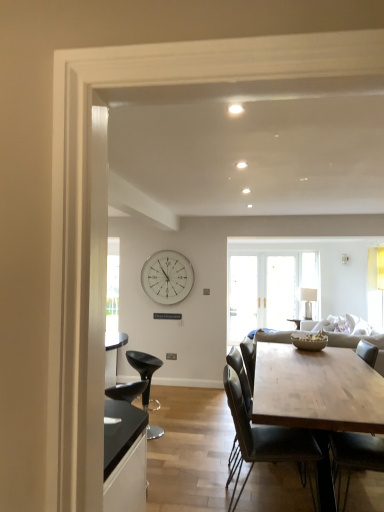
What do you see at coordinates (317, 397) in the screenshot? This screenshot has height=512, width=384. I see `natural wood table at center` at bounding box center [317, 397].

How much space does black plastic stool at lower left, which is the 1th chair in left-to-right order, occupy vertically?

It is 31.30 inches.

What are the coordinates of `black plastic stool at lower left, the first chair in the back-to-front sequence` in the screenshot? It's located at (144, 370).

At what (x,y) coordinates should I click in order to perform the action: click on light gray fabric couch at center. Please return your answer as a coordinate pair (x, y). This screenshot has width=384, height=512. Looking at the image, I should click on (356, 344).

What do you see at coordinates (265, 440) in the screenshot? I see `dark gray leather chair at center, the 2th chair when ordered from front to back` at bounding box center [265, 440].

In order to face wooden chair at center, which is the 3th chair from left to right, should I rotate leftwards or rightwards?

To face it directly, rotate right by 21.685 degrees.

This screenshot has height=512, width=384. I want to click on natural wood table at center, so click(317, 397).

From the image's perspective, between wooden chair at center, the third chair in the back-to-front sequence, and dark gray leather chair at center, the second chair viewed from the right, who is located below?

From the image's view, wooden chair at center, the third chair in the back-to-front sequence, is below.

This screenshot has width=384, height=512. I want to click on chair that is the 1st one when counting backward from the wooden chair at center, which is the first chair in front-to-back order, so click(x=265, y=440).

Which is less distant, [380,466] or [237,422]?

The point [237,422] is more forward.

How distant is wooden chair at center, which is the 3th chair from left to right, from dark gray leather chair at center, the 2th chair from the left?

They are 16.45 inches apart.

Looking at this image, which of these two, dark gray leather chair at center, which ranks as the 2th chair in back-to-front order, or natural wood table at center, is wider?

natural wood table at center is wider.

From the image's perspective, who appears lower, dark gray leather chair at center, the second chair viewed from the right, or natural wood table at center?

natural wood table at center is shown below in the image.

Are dark gray leather chair at center, which ranks as the 2th chair in back-to-front order, and natural wood table at center located far from each other?

No, dark gray leather chair at center, which ranks as the 2th chair in back-to-front order, is not far away from natural wood table at center.

Considering the relative sizes of dark gray leather chair at center, the 2th chair from the left, and natural wood table at center in the image provided, is dark gray leather chair at center, the 2th chair from the left, bigger than natural wood table at center?

No, dark gray leather chair at center, the 2th chair from the left, is not bigger than natural wood table at center.

Is black plastic stool at lower left, the first chair in the back-to-front sequence, at the left side of white glossy clock at upper center?

Yes.

From the image's perspective, is black plastic stool at lower left, marked as the 3th chair in a front-to-back arrangement, positioned above or below white glossy clock at upper center?

black plastic stool at lower left, marked as the 3th chair in a front-to-back arrangement, is below white glossy clock at upper center.

Does point (141, 364) lie in front of point (183, 294)?

Yes, point (141, 364) is closer to viewer.

Locate an element on the screen. clock above the black plastic stool at lower left, marked as the 3th chair in a front-to-back arrangement (from the image's perspective) is located at coordinates (167, 277).

From the image's perspective, which is below, dark gray leather chair at center, the 2th chair from the left, or wooden chair at center, which is the first chair in front-to-back order?

wooden chair at center, which is the first chair in front-to-back order, is shown below in the image.

Which is farther from the camera, (242,426) or (381,462)?

The point (381,462) is behind.

From a real-world perspective, is dark gray leather chair at center, the 2th chair when ordered from front to back, on top of wooden chair at center, the third chair in the back-to-front sequence?

No, from a real-world perspective, dark gray leather chair at center, the 2th chair when ordered from front to back, is not on top of wooden chair at center, the third chair in the back-to-front sequence.

Is natural wood table at center at the back of wooden chair at center, the third chair in the back-to-front sequence?

That's right, wooden chair at center, the third chair in the back-to-front sequence, is facing away from natural wood table at center.

Between wooden chair at center, which is the first chair in front-to-back order, and natural wood table at center, which one has larger width?

natural wood table at center is wider.

Is wooden chair at center, which is the first chair in front-to-back order, in contact with natural wood table at center?

wooden chair at center, which is the first chair in front-to-back order, and natural wood table at center are not in contact.

Is wooden chair at center, which is the first chair in front-to-back order, to the left of natural wood table at center from the viewer's perspective?

In fact, wooden chair at center, which is the first chair in front-to-back order, is to the right of natural wood table at center.

From the image's perspective, which one is positioned higher, natural wood table at center or black plastic stool at lower left, marked as the 3th chair in a right-to-left arrangement?

natural wood table at center.

Is natural wood table at center taller or shorter than black plastic stool at lower left, the first chair in the back-to-front sequence?

In the image, natural wood table at center appears to be shorter than black plastic stool at lower left, the first chair in the back-to-front sequence.

Could you tell me if natural wood table at center is turned towards black plastic stool at lower left, marked as the 3th chair in a right-to-left arrangement?

Yes, natural wood table at center is facing black plastic stool at lower left, marked as the 3th chair in a right-to-left arrangement.

Which is in front, natural wood table at center or black plastic stool at lower left, marked as the 3th chair in a front-to-back arrangement?

natural wood table at center is closer to the camera.

Between white glossy clock at upper center and black plastic stool at lower left, the first chair in the back-to-front sequence, which one is positioned in front?

black plastic stool at lower left, the first chair in the back-to-front sequence, is closer to the camera.

From a real-world perspective, relative to black plastic stool at lower left, the first chair in the back-to-front sequence, is white glossy clock at upper center vertically above or below?

From a real-world perspective, white glossy clock at upper center is physically above black plastic stool at lower left, the first chair in the back-to-front sequence.

Identify the location of clock above the black plastic stool at lower left, which is the 1th chair in left-to-right order (from the image's perspective). (167, 277).

Is white glossy clock at upper center positioned beyond the bounds of black plastic stool at lower left, the first chair in the back-to-front sequence?

white glossy clock at upper center is positioned outside black plastic stool at lower left, the first chair in the back-to-front sequence.

Where is `chair that is the 1st object to the left of the wooden chair at center, the third chair in the back-to-front sequence, starting at the anchor`? The height and width of the screenshot is (512, 384). chair that is the 1st object to the left of the wooden chair at center, the third chair in the back-to-front sequence, starting at the anchor is located at coordinates (265, 440).

This screenshot has height=512, width=384. I want to click on kitchen & dining room table below the dark gray leather chair at center, which ranks as the 2th chair in back-to-front order (from the image's perspective), so click(x=317, y=397).

Considering their positions, is white glossy clock at upper center positioned further to dark gray leather chair at center, the 2th chair from the left, than wooden chair at center, which is the first chair in front-to-back order?

Among the two, white glossy clock at upper center is located further to dark gray leather chair at center, the 2th chair from the left.

Looking at the image, which one is located further to light gray fabric couch at center, dark gray leather chair at center, the second chair viewed from the right, or natural wood table at center?

dark gray leather chair at center, the second chair viewed from the right, lies further to light gray fabric couch at center than the other object.

When comparing their distances from light gray fabric couch at center, does black plastic stool at lower left, marked as the 3th chair in a right-to-left arrangement, or natural wood table at center seem further?

black plastic stool at lower left, marked as the 3th chair in a right-to-left arrangement.

Estimate the real-world distances between objects in this image. Which object is further from natural wood table at center, light gray fabric couch at center or white glossy clock at upper center?

Among the two, white glossy clock at upper center is located further to natural wood table at center.

Which object lies further to the anchor point wooden chair at center, the third chair in the back-to-front sequence, natural wood table at center or dark gray leather chair at center, which ranks as the 2th chair in back-to-front order?

The object further to wooden chair at center, the third chair in the back-to-front sequence, is natural wood table at center.

Considering their positions, is wooden chair at center, the third chair in the back-to-front sequence, positioned further to dark gray leather chair at center, the 2th chair when ordered from front to back, than natural wood table at center?

wooden chair at center, the third chair in the back-to-front sequence, lies further to dark gray leather chair at center, the 2th chair when ordered from front to back, than the other object.

Based on their spatial positions, is natural wood table at center or light gray fabric couch at center closer to white glossy clock at upper center?

Based on the image, light gray fabric couch at center appears to be nearer to white glossy clock at upper center.

Estimate the real-world distances between objects in this image. Which object is further from light gray fabric couch at center, white glossy clock at upper center or black plastic stool at lower left, marked as the 3th chair in a right-to-left arrangement?

Among the two, white glossy clock at upper center is located further to light gray fabric couch at center.

Image resolution: width=384 pixels, height=512 pixels. Find the location of `chair between black plastic stool at lower left, marked as the 3th chair in a right-to-left arrangement, and wooden chair at center, the third chair in the back-to-front sequence, from left to right`. chair between black plastic stool at lower left, marked as the 3th chair in a right-to-left arrangement, and wooden chair at center, the third chair in the back-to-front sequence, from left to right is located at coordinates (265, 440).

At what (x,y) coordinates should I click in order to perform the action: click on couch between natural wood table at center and white glossy clock at upper center in the front-back direction. Please return your answer as a coordinate pair (x, y). This screenshot has height=512, width=384. Looking at the image, I should click on (356, 344).

At what (x,y) coordinates should I click in order to perform the action: click on couch between wooden chair at center, which is the first chair in front-to-back order, and white glossy clock at upper center in the front-back direction. Please return your answer as a coordinate pair (x, y). The width and height of the screenshot is (384, 512). Looking at the image, I should click on (356, 344).

The height and width of the screenshot is (512, 384). Identify the location of couch between dark gray leather chair at center, which ranks as the 2th chair in back-to-front order, and white glossy clock at upper center from front to back. (356, 344).